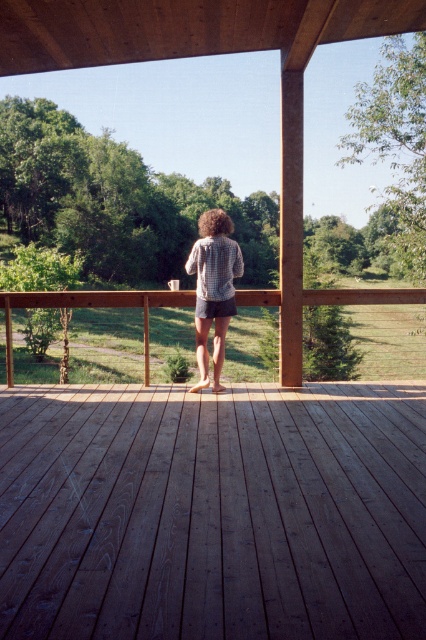
You are standing on the ground near the brown wooden deck at center. You want to place a 2.5 meter long ladder horizontally between the deck and your current position. Is the space between you and the deck sufficient to fit the ladder?

The distance between you and the brown wooden deck at center is 2.32 meters, which is shorter than the 2.5 meter ladder. Therefore, the ladder will not fit horizontally in the available space.

You are standing on the wooden deck and want to place a small potted plant between the two points marked as point (187,300) and point (227,300). Which point should the plant be closer to in order to be nearer to the viewer?

The plant should be closer to point (187,300) because it is further to the viewer than point (227,300).